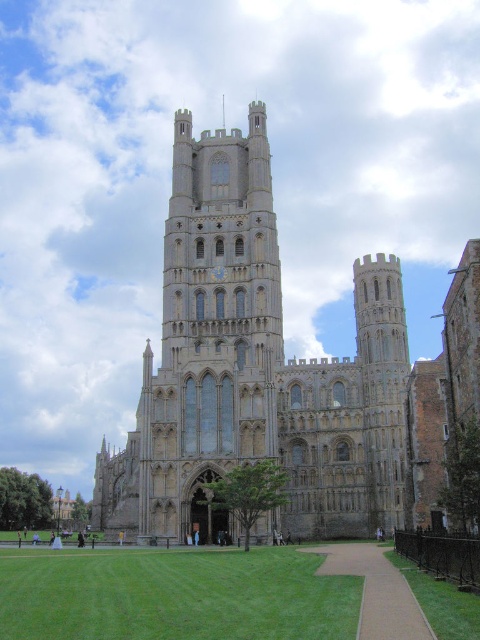
Is stone church at center smaller than green grass at lower right?

No, stone church at center is not smaller than green grass at lower right.

Between point (294, 408) and point (416, 592), which one is positioned behind?

Point (294, 408)

This screenshot has height=640, width=480. I want to click on stone church at center, so click(254, 371).

Is light brown paved path at lower center wider than green grass at lower right?

Indeed, light brown paved path at lower center has a greater width compared to green grass at lower right.

Does point (363, 541) lie in front of point (431, 604)?

No, it is not.

Locate an element on the screen. The height and width of the screenshot is (640, 480). light brown paved path at lower center is located at coordinates (375, 589).

This screenshot has width=480, height=640. I want to click on light brown paved path at lower center, so click(375, 589).

Can you confirm if stone church at center is positioned to the left of green grass at lower center?

Yes, stone church at center is to the left of green grass at lower center.

Does stone church at center have a greater width compared to green grass at lower center?

Yes, stone church at center is wider than green grass at lower center.

Consider the image. Who is more distant from viewer, (268, 228) or (59, 609)?

Point (268, 228)

I want to click on stone church at center, so click(254, 371).